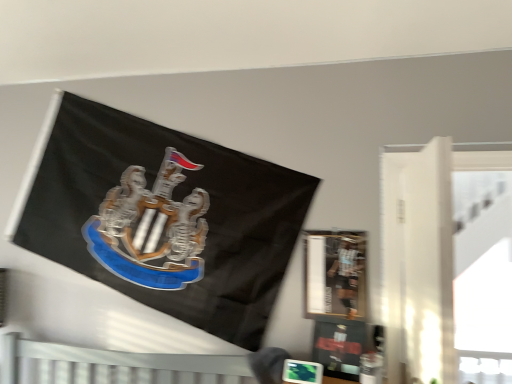
What do you see at coordinates (346, 274) in the screenshot?
I see `metallic silver frame at upper right` at bounding box center [346, 274].

In order to face metallic silver frame at upper right, should I rotate leftwards or rightwards?

You should look right and rotate roughly 10.566 degrees.

Where is `metallic silver frame at upper right`? Image resolution: width=512 pixels, height=384 pixels. metallic silver frame at upper right is located at coordinates (346, 274).

This screenshot has height=384, width=512. What do you see at coordinates (418, 264) in the screenshot?
I see `white sheer curtain at right` at bounding box center [418, 264].

What are the coordinates of `white sheer curtain at right` in the screenshot? It's located at (418, 264).

Find the location of `metallic silver frame at upper right`. metallic silver frame at upper right is located at coordinates (346, 274).

Would you say white sheer curtain at right is to the left or to the right of metallic silver frame at upper right in the picture?

Based on their positions, white sheer curtain at right is located to the right of metallic silver frame at upper right.

Considering the positions of objects white sheer curtain at right and metallic silver frame at upper right in the image provided, who is in front, white sheer curtain at right or metallic silver frame at upper right?

white sheer curtain at right is more forward.

Is point (417, 160) behind point (347, 311)?

That is False.

From the image's perspective, does white sheer curtain at right appear lower than metallic silver frame at upper right?

No, from the image's perspective, white sheer curtain at right is not below metallic silver frame at upper right.

From a real-world perspective, is white sheer curtain at right on metallic silver frame at upper right?

Yes, from a real-world perspective, white sheer curtain at right is over metallic silver frame at upper right

In terms of width, does white sheer curtain at right look wider or thinner when compared to metallic silver frame at upper right?

Clearly, white sheer curtain at right has more width compared to metallic silver frame at upper right.

Considering the sizes of objects white sheer curtain at right and metallic silver frame at upper right in the image provided, who is taller, white sheer curtain at right or metallic silver frame at upper right?

Standing taller between the two is white sheer curtain at right.

Based on their sizes in the image, would you say white sheer curtain at right is bigger or smaller than metallic silver frame at upper right?

Considering their sizes, white sheer curtain at right takes up more space than metallic silver frame at upper right.

Does white sheer curtain at right contain metallic silver frame at upper right?

Actually, metallic silver frame at upper right is outside white sheer curtain at right.

Is white sheer curtain at right far away from metallic silver frame at upper right?

No, white sheer curtain at right is not far away from metallic silver frame at upper right.

Does white sheer curtain at right turn towards metallic silver frame at upper right?

No, white sheer curtain at right is not oriented towards metallic silver frame at upper right.

Can you tell me how much white sheer curtain at right and metallic silver frame at upper right differ in facing direction?

The facing directions of white sheer curtain at right and metallic silver frame at upper right are 1.52 degrees apart.

Locate an element on the screen. The height and width of the screenshot is (384, 512). person on the left side of white sheer curtain at right is located at coordinates (346, 274).

Which is more to the right, metallic silver frame at upper right or white sheer curtain at right?

From the viewer's perspective, white sheer curtain at right appears more on the right side.

Who is more distant, metallic silver frame at upper right or white sheer curtain at right?

Positioned behind is metallic silver frame at upper right.

Does point (351, 302) appear closer or farther from the camera than point (385, 240)?

Point (351, 302) appears to be closer to the viewer than point (385, 240).

From the image's perspective, is metallic silver frame at upper right above or below white sheer curtain at right?

metallic silver frame at upper right is situated lower than white sheer curtain at right in the image.

From a real-world perspective, is metallic silver frame at upper right positioned under white sheer curtain at right based on gravity?

Yes, from a real-world perspective, metallic silver frame at upper right is under white sheer curtain at right.

Which object is thinner, metallic silver frame at upper right or white sheer curtain at right?

With smaller width is metallic silver frame at upper right.

Based on the photo, which of these two, metallic silver frame at upper right or white sheer curtain at right, stands shorter?

metallic silver frame at upper right.

Based on their sizes in the image, would you say metallic silver frame at upper right is bigger or smaller than white sheer curtain at right?

metallic silver frame at upper right is smaller than white sheer curtain at right.

Is metallic silver frame at upper right inside the boundaries of white sheer curtain at right, or outside?

metallic silver frame at upper right is located beyond the bounds of white sheer curtain at right.

Is metallic silver frame at upper right next to white sheer curtain at right?

metallic silver frame at upper right and white sheer curtain at right are clearly separated.

Does metallic silver frame at upper right turn towards white sheer curtain at right?

No, metallic silver frame at upper right is not turned towards white sheer curtain at right.

The image size is (512, 384). What are the coordinates of `door that appears in front of the metallic silver frame at upper right` in the screenshot? It's located at (418, 264).

Where is `door on the right of the metallic silver frame at upper right`? The height and width of the screenshot is (384, 512). door on the right of the metallic silver frame at upper right is located at coordinates (418, 264).

Locate an element on the screen. This screenshot has height=384, width=512. person directly beneath the white sheer curtain at right (from a real-world perspective) is located at coordinates (346, 274).